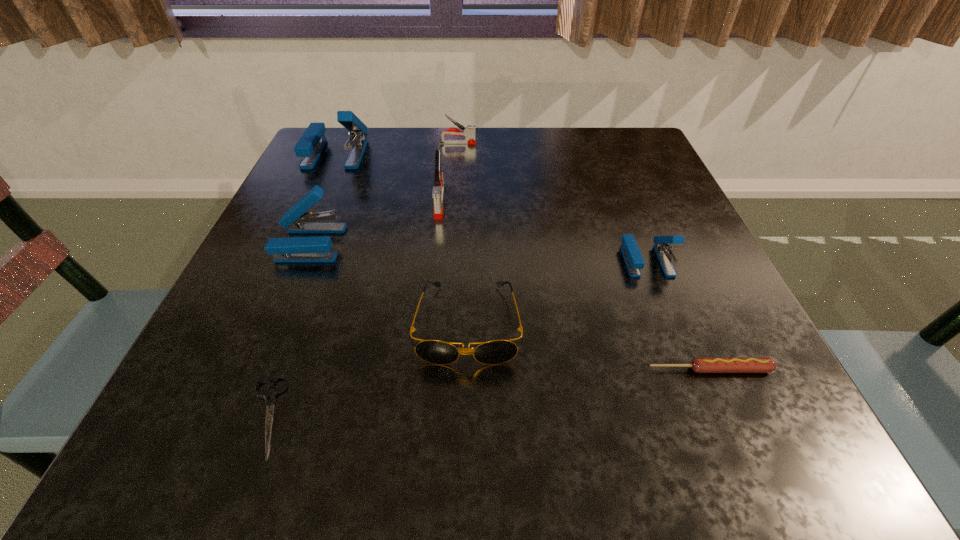
In the image, there is a desktop. Where is `vacant space at the right edge`? vacant space at the right edge is located at coordinates (678, 205).

Locate an element on the screen. The height and width of the screenshot is (540, 960). vacant area at the far left corner of the desktop is located at coordinates (348, 172).

Where is `free space at the far right corner of the desktop`? free space at the far right corner of the desktop is located at coordinates (614, 147).

The height and width of the screenshot is (540, 960). I want to click on vacant space at the near right corner of the desktop, so click(x=744, y=412).

Where is `free point between the sausage and the third farthest object`? The height and width of the screenshot is (540, 960). free point between the sausage and the third farthest object is located at coordinates (575, 286).

Locate an element on the screen. This screenshot has width=960, height=540. vacant space that is in between the bigger gray stapler and the second biggest blue stapler is located at coordinates (375, 222).

You are a GUI agent. You are given a task and a screenshot of the screen. Output one action in this format:
    pyautogui.click(x=<x>, y=<y>)
    Task: Click on the blank region between the third shortest object and the farther gray stapler
    This screenshot has width=960, height=540.
    Given the screenshot: What is the action you would take?
    pyautogui.click(x=463, y=233)

Locate an element on the screen. This screenshot has height=540, width=960. free spot between the bigger gray stapler and the second biggest blue stapler is located at coordinates (375, 222).

Where is `free area in between the sunglasses and the shears`? The width and height of the screenshot is (960, 540). free area in between the sunglasses and the shears is located at coordinates (366, 369).

Identify the location of vacant point located between the rightmost blue stapler and the farther gray stapler. The height and width of the screenshot is (540, 960). (552, 202).